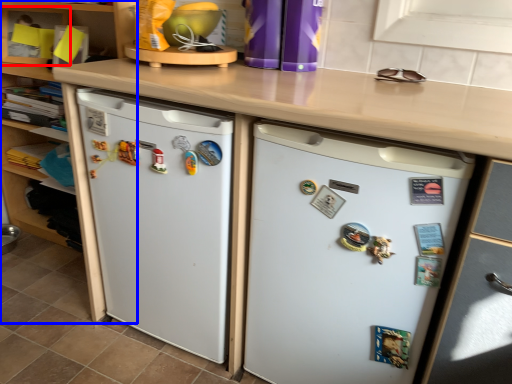
Question: Among these objects, which one is nearest to the camera, shelf (highlighted by a red box) or cabinetry (highlighted by a blue box)?

Choices:
 (A) shelf
 (B) cabinetry

Answer: (B)